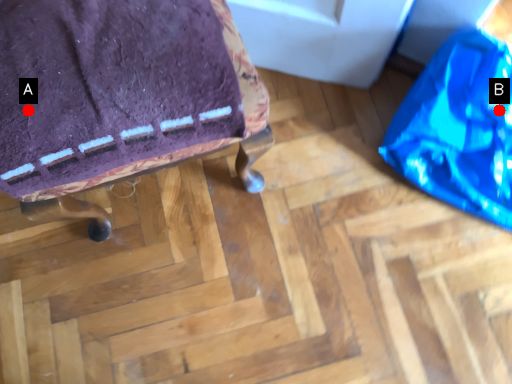
Question: Two points are circled on the image, labeled by A and B beside each circle. Which point is closer to the camera taking this photo?

Choices:
 (A) A is closer
 (B) B is closer

Answer: (A)